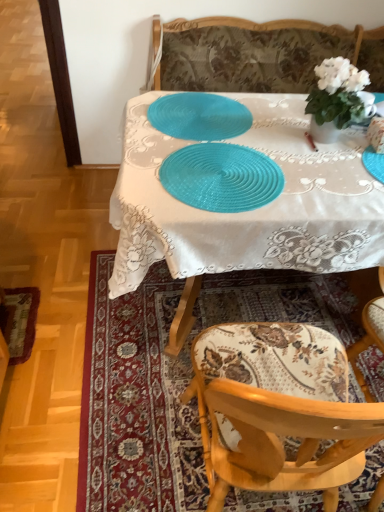
You are a GUI agent. You are given a task and a screenshot of the screen. Output one action in this format:
    pyautogui.click(x=<x>, y=<y>)
    Task: Click on the blank area to the left of white glossy vase at upper right
    Image resolution: width=384 pixels, height=512 pixels.
    Given the screenshot: What is the action you would take?
    pyautogui.click(x=277, y=130)